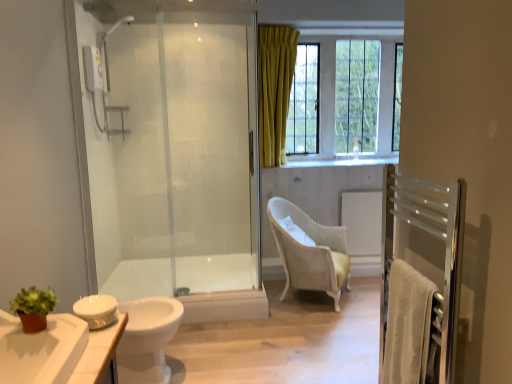
Identify the location of free spot in front of white glossy faucet at upper center. (359, 163).